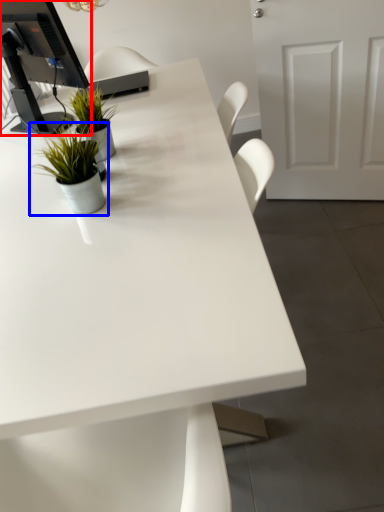
Question: Among these objects, which one is farthest to the camera, desktop computer (highlighted by a red box) or houseplant (highlighted by a blue box)?

Choices:
 (A) desktop computer
 (B) houseplant

Answer: (A)